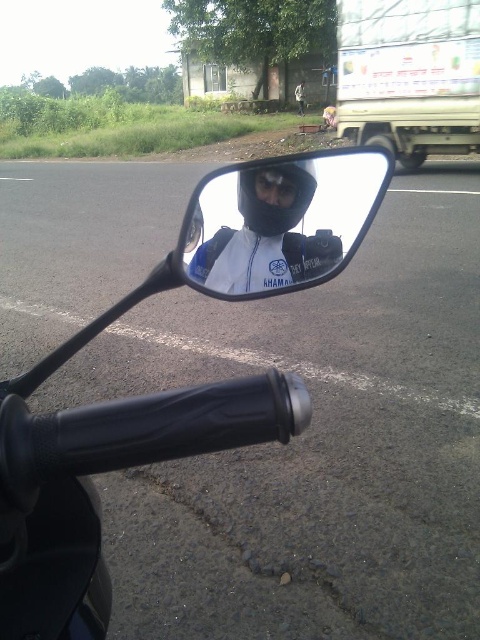
Between black matte motorcycle handlebar at center and matte black mirror at center, which one is positioned higher?

matte black mirror at center is above.

Between point (269, 280) and point (230, 204), which one is positioned behind?

The point (269, 280) is more distant.

You are a GUI agent. You are given a task and a screenshot of the screen. Output one action in this format:
    pyautogui.click(x=<x>, y=<y>)
    Task: Click on the black matte motorcycle handlebar at center
    The width and height of the screenshot is (480, 640).
    Given the screenshot: What is the action you would take?
    pyautogui.click(x=175, y=388)